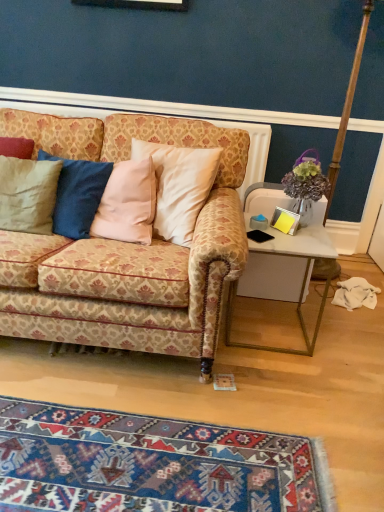
Where is `vacant area located to the right-hand side of white glossy desk at right`? The width and height of the screenshot is (384, 512). vacant area located to the right-hand side of white glossy desk at right is located at coordinates (345, 342).